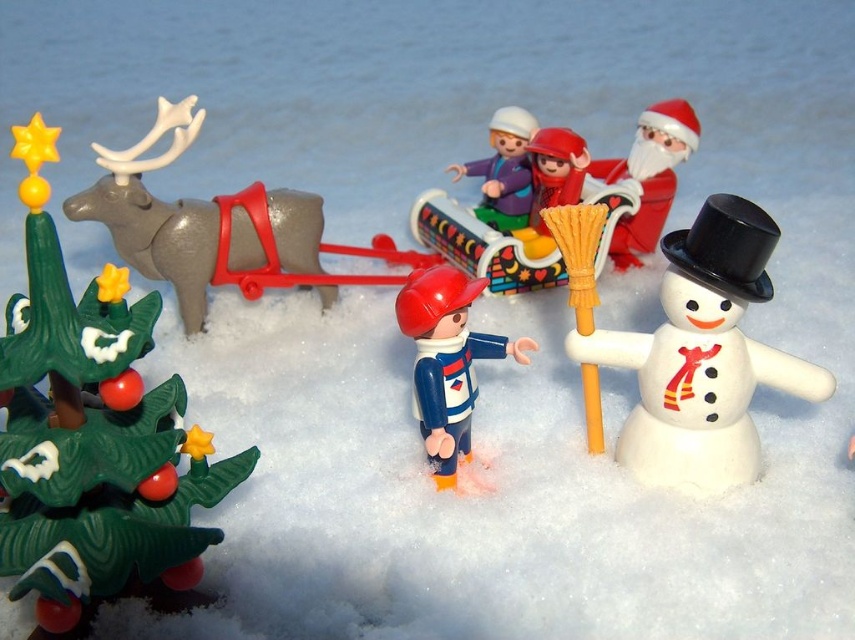
Is green plastic christmas tree at left taller than gray matte reindeer at left?

Yes.

Can you confirm if green plastic christmas tree at left is positioned above gray matte reindeer at left?

No.

Is point (146, 492) closer to viewer compared to point (122, 205)?

That is True.

Locate an element on the screen. This screenshot has height=640, width=855. green plastic christmas tree at left is located at coordinates (92, 435).

The image size is (855, 640). What are the coordinates of `gray matte reindeer at left` in the screenshot? It's located at (156, 212).

Which is more to the right, gray matte reindeer at left or smooth plastic sleigh at center?

Positioned to the right is smooth plastic sleigh at center.

Identify the location of gray matte reindeer at left. The image size is (855, 640). [156, 212].

Does white matte santa at upper right appear under smooth plastic sleigh at center?

No.

Can you confirm if white matte santa at upper right is positioned to the left of smooth plastic sleigh at center?

No, white matte santa at upper right is not to the left of smooth plastic sleigh at center.

This screenshot has width=855, height=640. I want to click on white matte santa at upper right, so click(649, 176).